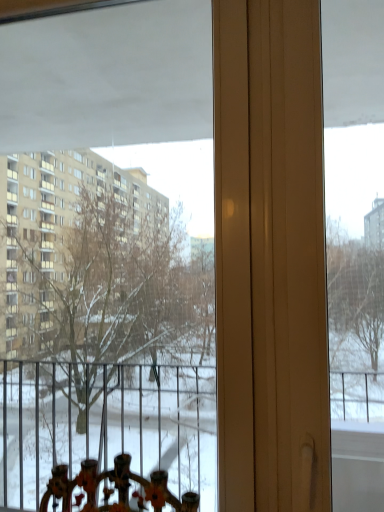
Describe the element at coordinates (355, 253) in the screenshot. I see `transparent plastic screen at center` at that location.

Locate an element on the screen. Image resolution: width=384 pixels, height=512 pixels. transparent plastic screen at center is located at coordinates (355, 253).

You are a GUI agent. You are given a task and a screenshot of the screen. Output one action in this format:
    pyautogui.click(x=<x>, y=<y>)
    Task: Click on the transparent glass window at center
    
    Given the screenshot: What is the action you would take?
    pyautogui.click(x=100, y=344)

The image size is (384, 512). What do you see at coordinates (100, 344) in the screenshot?
I see `transparent glass window at center` at bounding box center [100, 344].

Image resolution: width=384 pixels, height=512 pixels. Identify the location of transparent plastic screen at center. pos(355,253).

Can you confirm if transparent glass window at center is positioned to the left of transparent plastic screen at center?

Correct, you'll find transparent glass window at center to the left of transparent plastic screen at center.

In the image, is transparent glass window at center positioned in front of or behind transparent plastic screen at center?

Visually, transparent glass window at center is located behind transparent plastic screen at center.

Which is in front, point (106, 408) or point (345, 149)?

The point (345, 149) is closer to the camera.

From the image's perspective, is transparent glass window at center on top of transparent plastic screen at center?

Indeed, from the image's perspective, transparent glass window at center is shown above transparent plastic screen at center.

From a real-world perspective, between transparent glass window at center and transparent plastic screen at center, who is vertically higher?

From a 3D spatial view, transparent glass window at center is above.

Considering the sizes of transparent glass window at center and transparent plastic screen at center in the image, is transparent glass window at center wider or thinner than transparent plastic screen at center?

Considering their sizes, transparent glass window at center looks slimmer than transparent plastic screen at center.

Is transparent glass window at center taller or shorter than transparent plastic screen at center?

Clearly, transparent glass window at center is taller compared to transparent plastic screen at center.

Between transparent glass window at center and transparent plastic screen at center, which one has larger size?

With larger size is transparent glass window at center.

Is transparent plastic screen at center surrounded by transparent glass window at center?

Actually, transparent plastic screen at center is outside transparent glass window at center.

Are transparent glass window at center and transparent plastic screen at center making contact?

No, transparent glass window at center is not with transparent plastic screen at center.

Is transparent glass window at center oriented away from transparent plastic screen at center?

No, transparent glass window at center's orientation is not away from transparent plastic screen at center.

Measure the distance from transparent glass window at center to transparent plastic screen at center.

transparent glass window at center is 1.16 meters away from transparent plastic screen at center.

The image size is (384, 512). I want to click on window screen lying below the transparent glass window at center (from the image's perspective), so click(x=355, y=253).

Is transparent plastic screen at center to the left of transparent glass window at center from the viewer's perspective?

Incorrect, transparent plastic screen at center is not on the left side of transparent glass window at center.

Is transparent plastic screen at center closer to the viewer compared to transparent glass window at center?

Yes, it is.

Is point (371, 213) farther from viewer compared to point (89, 172)?

No.

From the image's perspective, relative to transparent glass window at center, is transparent plastic screen at center above or below?

Clearly, from the image's perspective, transparent plastic screen at center is below transparent glass window at center.

Based on the photo, from a real-world perspective, is transparent plastic screen at center positioned above or below transparent glass window at center?

transparent plastic screen at center is below transparent glass window at center.

Is transparent plastic screen at center wider than transparent glass window at center?

Indeed, transparent plastic screen at center has a greater width compared to transparent glass window at center.

Who is shorter, transparent plastic screen at center or transparent glass window at center?

transparent plastic screen at center.

Who is smaller, transparent plastic screen at center or transparent glass window at center?

transparent plastic screen at center is smaller.

Is transparent plastic screen at center not within transparent glass window at center?

Yes, transparent plastic screen at center is located beyond the bounds of transparent glass window at center.

From the picture: Can you see transparent plastic screen at center touching transparent glass window at center?

There is a gap between transparent plastic screen at center and transparent glass window at center.

Could you tell me if transparent plastic screen at center is turned towards transparent glass window at center?

No, transparent plastic screen at center does not turn towards transparent glass window at center.

How many degrees apart are the facing directions of transparent plastic screen at center and transparent glass window at center?

The angle between the facing direction of transparent plastic screen at center and the facing direction of transparent glass window at center is 0.00206 degrees.

You are a GUI agent. You are given a task and a screenshot of the screen. Output one action in this format:
    pyautogui.click(x=<x>, y=<y>)
    Task: Click on the window screen on the right side of transparent glass window at center
    Image resolution: width=384 pixels, height=512 pixels.
    Given the screenshot: What is the action you would take?
    pyautogui.click(x=355, y=253)

The image size is (384, 512). I want to click on window on the left of transparent plastic screen at center, so click(100, 344).

Find the location of `window above the transparent plastic screen at center (from the image's perspective)`. window above the transparent plastic screen at center (from the image's perspective) is located at coordinates (100, 344).